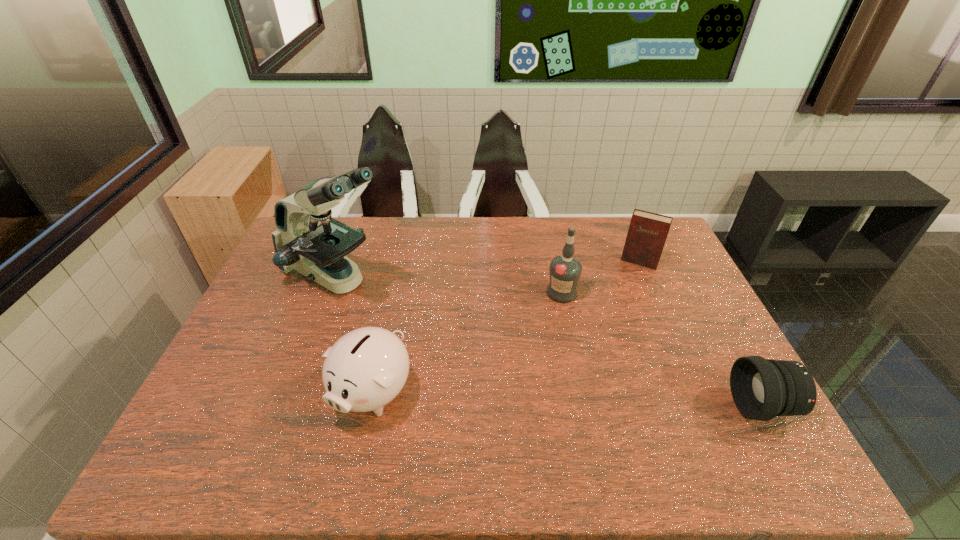
I want to click on free space between the rightmost object and the piggy bank, so click(x=567, y=399).

What are the coordinates of `free space between the tallest object and the rightmost object` in the screenshot? It's located at (x=549, y=342).

Where is `free point between the vodka and the diary`? This screenshot has width=960, height=540. free point between the vodka and the diary is located at coordinates (601, 277).

Identify the location of unoccupied position between the tallest object and the diary. (488, 270).

Identify the location of free space between the second tallest object and the diary. click(601, 277).

I want to click on empty location between the tallest object and the third object from right to left, so click(x=449, y=285).

The image size is (960, 540). I want to click on object that is the second closest to the shortest object, so click(x=647, y=233).

Locate which object ranks third in proximity to the tallest object. Please provide its 2D coordinates. Your answer should be formatted as a tuple, i.e. [(x, y)], where the tuple contains the x and y coordinates of a point satisfying the conditions above.

[(647, 233)]

Where is `free location that satisfies the following two spatial constraints: 1. on the front side of the tallest object; 2. on the left side of the vodka`? free location that satisfies the following two spatial constraints: 1. on the front side of the tallest object; 2. on the left side of the vodka is located at coordinates (330, 293).

This screenshot has width=960, height=540. What are the coordinates of `vacant area in the image that satisfies the following two spatial constraints: 1. on the front side of the piggy bank; 2. on the left side of the microscope` in the screenshot? It's located at (293, 393).